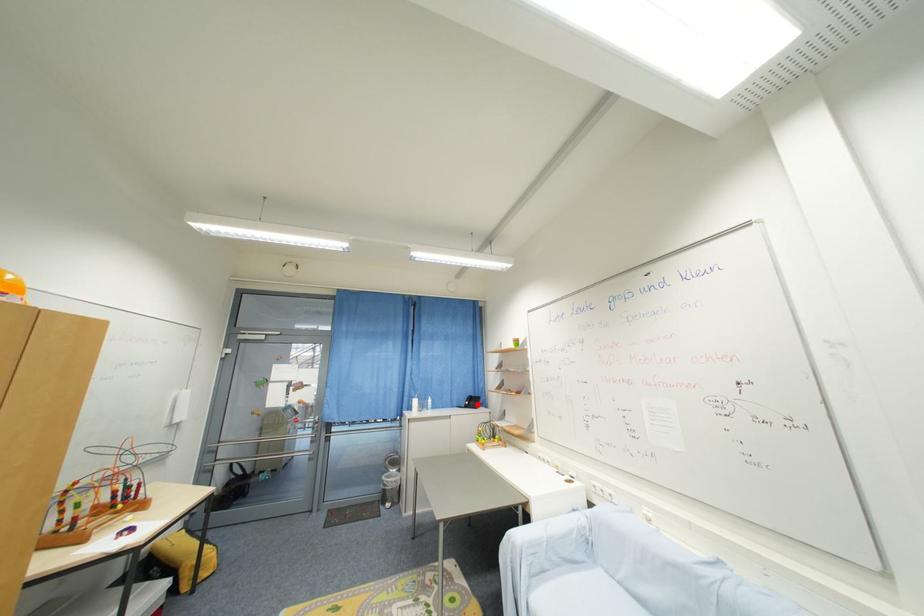
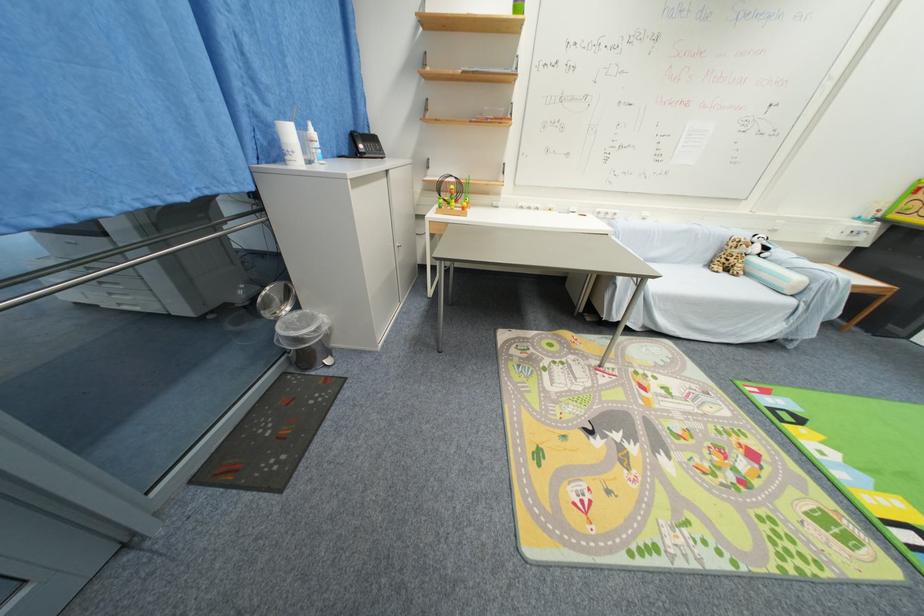
Locate, in the second image, the point that corresponds to the highlighted location in the first image.

(377, 148)